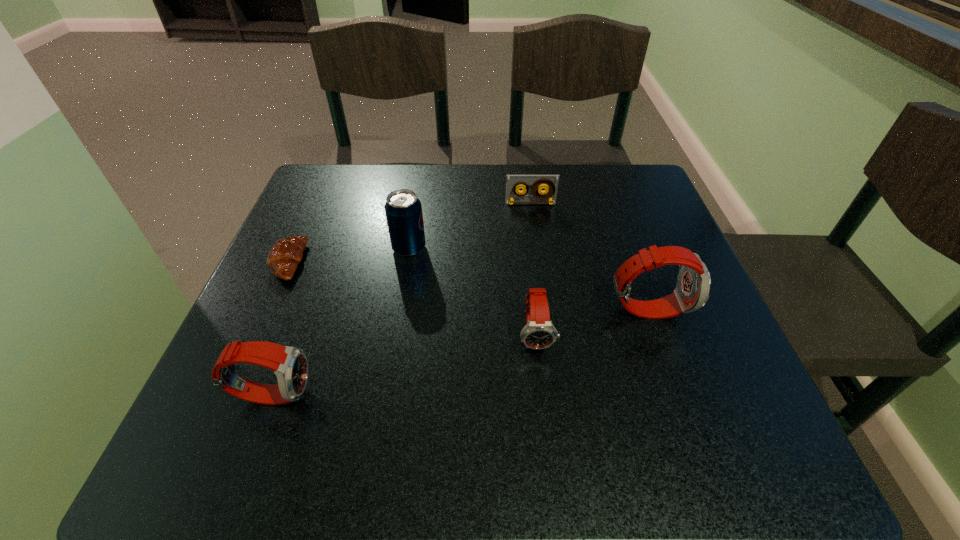
The width and height of the screenshot is (960, 540). Identify the location of object positioned at the near left corner. (290, 365).

Locate an element on the screen. Image resolution: width=960 pixels, height=540 pixels. free location at the far edge is located at coordinates (563, 210).

At what (x,y) coordinates should I click in order to perform the action: click on free space at the near edge of the desktop. Please return your answer as a coordinate pair (x, y). Looking at the image, I should click on (581, 404).

Find the location of a particular element. free spot at the left edge of the desktop is located at coordinates (341, 269).

At what (x,y) coordinates should I click in order to perform the action: click on free spot at the right edge of the desktop. Please return your answer as a coordinate pair (x, y). The height and width of the screenshot is (540, 960). Looking at the image, I should click on (645, 349).

Where is `free region at the far left corner`? The image size is (960, 540). free region at the far left corner is located at coordinates (306, 197).

Where is `vacant region at the far right corner`? Image resolution: width=960 pixels, height=540 pixels. vacant region at the far right corner is located at coordinates (600, 167).

Identify the location of vacant space at the near right corner. pos(662,403).

Locate an element on the screen. The width and height of the screenshot is (960, 540). free spot between the crescent roll and the fourth object from right to left is located at coordinates (348, 255).

Image resolution: width=960 pixels, height=540 pixels. I want to click on vacant region between the tallest watch and the leftmost watch, so click(460, 352).